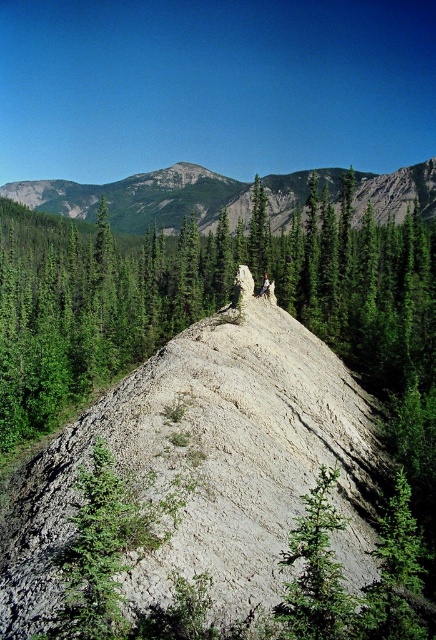
Question: Is the position of green rough textured tree at center more distant than that of camouflage fabric hiker at center?

Choices:
 (A) no
 (B) yes

Answer: (A)

Question: Which object appears farthest from the camera in this image?

Choices:
 (A) green rough textured tree at center
 (B) rocky mountain at center

Answer: (B)

Question: Which point is farther to the camera?

Choices:
 (A) (289, 554)
 (B) (290, 198)
 (C) (259, 288)

Answer: (B)

Question: Which of these objects is positioned closest to the green rough textured tree at center?

Choices:
 (A) camouflage fabric hiker at center
 (B) rocky mountain at center

Answer: (A)

Question: Is rocky mountain at center below green rough textured tree at center?

Choices:
 (A) yes
 (B) no

Answer: (B)

Question: Considering the relative positions of rocky mountain at center and camouflage fabric hiker at center in the image provided, where is rocky mountain at center located with respect to camouflage fabric hiker at center?

Choices:
 (A) above
 (B) below

Answer: (A)